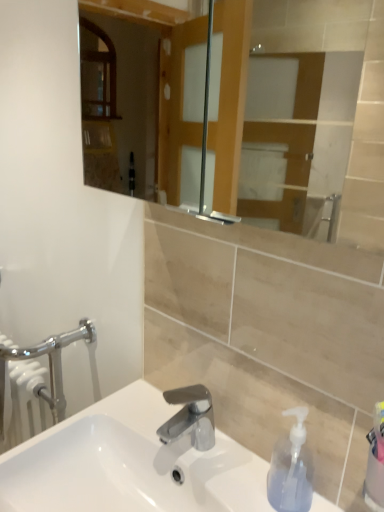
The height and width of the screenshot is (512, 384). Describe the element at coordinates (190, 417) in the screenshot. I see `chrome metallic faucet at center` at that location.

Measure the distance between white glossy sink at center and camera.

They are 28.77 inches apart.

Identify the location of chrome metallic faucet at center. This screenshot has height=512, width=384. (190, 417).

From a real-world perspective, who is located higher, white glossy sink at center or chrome metallic faucet at center?

chrome metallic faucet at center.

Between white glossy sink at center and chrome metallic faucet at center, which one has smaller size?

With smaller size is chrome metallic faucet at center.

Could you tell me if white glossy sink at center is facing chrome metallic faucet at center?

No, white glossy sink at center is not turned towards chrome metallic faucet at center.

Locate an element on the screen. sink lying below the chrome metallic faucet at center (from the image's perspective) is located at coordinates (128, 464).

Is chrome metallic faucet at center positioned beyond the bounds of white glossy sink at center?

Yes.

Considering the positions of point (198, 433) and point (99, 483), is point (198, 433) closer or farther from the camera than point (99, 483)?

Point (198, 433) is positioned farther from the camera compared to point (99, 483).

Is chrome metallic faucet at center aimed at white glossy sink at center?

No, chrome metallic faucet at center is not turned towards white glossy sink at center.

Considering the relative sizes of transparent plastic soap dispenser at lower right and chrome metallic faucet at center in the image provided, is transparent plastic soap dispenser at lower right wider than chrome metallic faucet at center?

In fact, transparent plastic soap dispenser at lower right might be narrower than chrome metallic faucet at center.

Is chrome metallic faucet at center at the back of transparent plastic soap dispenser at lower right?

No, transparent plastic soap dispenser at lower right is not facing the opposite direction of chrome metallic faucet at center.

Image resolution: width=384 pixels, height=512 pixels. I want to click on soap dispenser located on the right of chrome metallic faucet at center, so click(x=291, y=469).

From a real-world perspective, is transparent plastic soap dispenser at lower right above or below chrome metallic faucet at center?

Clearly, from a real-world perspective, transparent plastic soap dispenser at lower right is above chrome metallic faucet at center.

Is white glossy sink at center with transparent plastic soap dispenser at lower right?

No, white glossy sink at center is not in contact with transparent plastic soap dispenser at lower right.

Which object is more forward, white glossy sink at center or transparent plastic soap dispenser at lower right?

Positioned in front is white glossy sink at center.

From a real-world perspective, who is located higher, white glossy sink at center or transparent plastic soap dispenser at lower right?

transparent plastic soap dispenser at lower right.

Is white glossy sink at center looking in the opposite direction of transparent plastic soap dispenser at lower right?

No, white glossy sink at center's orientation is not away from transparent plastic soap dispenser at lower right.

Locate an element on the screen. soap dispenser that is below the chrome metallic faucet at center (from the image's perspective) is located at coordinates (291, 469).

Does chrome metallic faucet at center have a greater width compared to transparent plastic soap dispenser at lower right?

Yes.

Is transparent plastic soap dispenser at lower right facing towards white glossy sink at center?

No, transparent plastic soap dispenser at lower right is not oriented towards white glossy sink at center.

From the image's perspective, relative to white glossy sink at center, is transparent plastic soap dispenser at lower right above or below?

transparent plastic soap dispenser at lower right is situated higher than white glossy sink at center in the image.

Do you think transparent plastic soap dispenser at lower right is within white glossy sink at center, or outside of it?

transparent plastic soap dispenser at lower right is not inside white glossy sink at center, it's outside.

In the scene shown: How many degrees apart are the facing directions of transparent plastic soap dispenser at lower right and white glossy sink at center?

The angle between the facing direction of transparent plastic soap dispenser at lower right and the facing direction of white glossy sink at center is 0.662 degrees.

At what (x,y) coordinates should I click in order to perform the action: click on tap lying on the right of white glossy sink at center. Please return your answer as a coordinate pair (x, y). The width and height of the screenshot is (384, 512). Looking at the image, I should click on [190, 417].

In the image, there is a chrome metallic faucet at center. At what (x,y) coordinates should I click in order to perform the action: click on sink below it (from the image's perspective). Please return your answer as a coordinate pair (x, y). Looking at the image, I should click on (128, 464).

Looking at the image, which one is located further to transparent plastic soap dispenser at lower right, white glossy sink at center or chrome metallic faucet at center?

white glossy sink at center is further to transparent plastic soap dispenser at lower right.

Estimate the real-world distances between objects in this image. Which object is closer to transparent plastic soap dispenser at lower right, chrome metallic faucet at center or white glossy sink at center?

Among the two, chrome metallic faucet at center is located nearer to transparent plastic soap dispenser at lower right.

Which object lies further to the anchor point white glossy sink at center, transparent plastic soap dispenser at lower right or chrome metallic faucet at center?

A: The object further to white glossy sink at center is transparent plastic soap dispenser at lower right.

Consider the image. Estimate the real-world distances between objects in this image. Which object is closer to white glossy sink at center, chrome metallic faucet at center or transparent plastic soap dispenser at lower right?

chrome metallic faucet at center is positioned closer to the anchor white glossy sink at center.

Looking at the image, which one is located further to chrome metallic faucet at center, transparent plastic soap dispenser at lower right or white glossy sink at center?

The object further to chrome metallic faucet at center is transparent plastic soap dispenser at lower right.

Considering their positions, is white glossy sink at center positioned closer to chrome metallic faucet at center than transparent plastic soap dispenser at lower right?

white glossy sink at center is positioned closer to the anchor chrome metallic faucet at center.

Find the location of `soap dispenser between white glossy sink at center and chrome metallic faucet at center along the z-axis`. soap dispenser between white glossy sink at center and chrome metallic faucet at center along the z-axis is located at coordinates (291, 469).